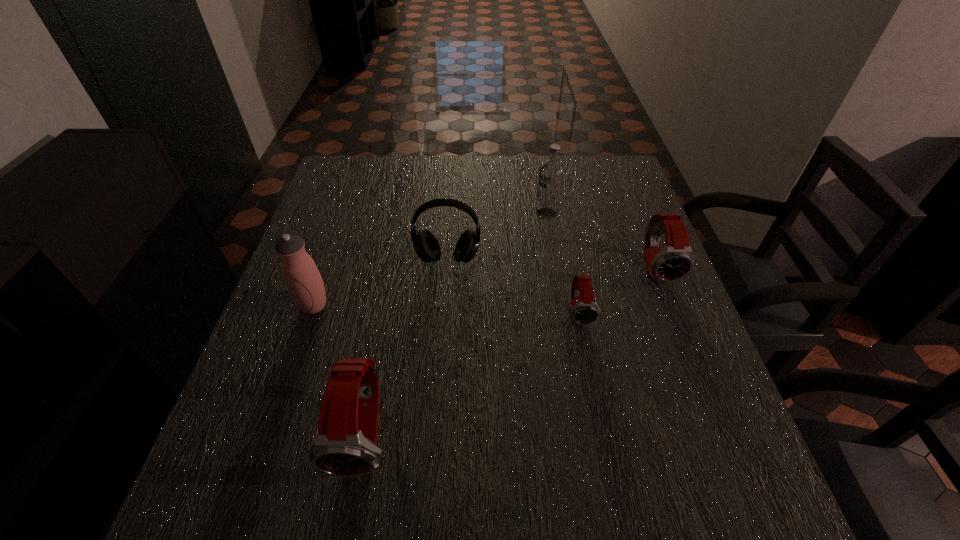
The image size is (960, 540). I want to click on vacant position located 0.160m on the face of the rightmost object, so click(x=688, y=349).

I want to click on free space located on the ear cups of the headset, so click(444, 302).

You are a GUI agent. You are given a task and a screenshot of the screen. Output one action in this format:
    pyautogui.click(x=<x>, y=<y>)
    Task: Click on the free space located 0.300m on the back of the leftmost object
    The width and height of the screenshot is (960, 540).
    Given the screenshot: What is the action you would take?
    pyautogui.click(x=346, y=214)

What are the coordinates of `vacant point located on the front label of the farthest object` in the screenshot? It's located at (405, 214).

This screenshot has height=540, width=960. In order to click on vacant area located on the front label of the farthest object in this screenshot , I will do `click(405, 214)`.

Where is `vacant area situated on the front label of the farthest object`? The image size is (960, 540). vacant area situated on the front label of the farthest object is located at coordinates (452, 214).

The width and height of the screenshot is (960, 540). I want to click on object located in the near edge section of the desktop, so click(345, 445).

Where is `object situated at the left edge`? object situated at the left edge is located at coordinates (303, 280).

At what (x,y) coordinates should I click in order to perform the action: click on object located at the right edge. Please return your answer as a coordinate pair (x, y). Looking at the image, I should click on (676, 260).

Image resolution: width=960 pixels, height=540 pixels. In the image, there is a desktop. Find the location of `vacant space at the far edge`. vacant space at the far edge is located at coordinates (511, 156).